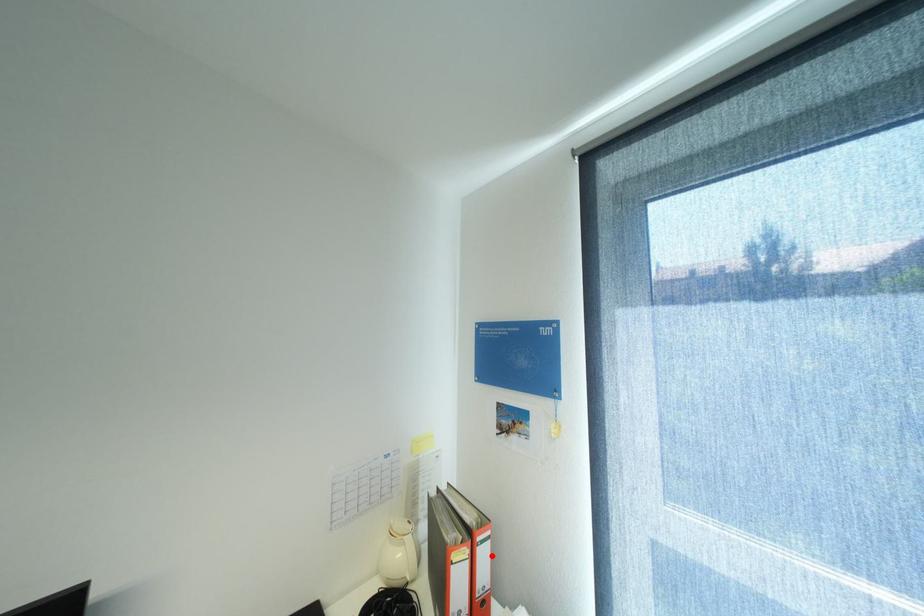
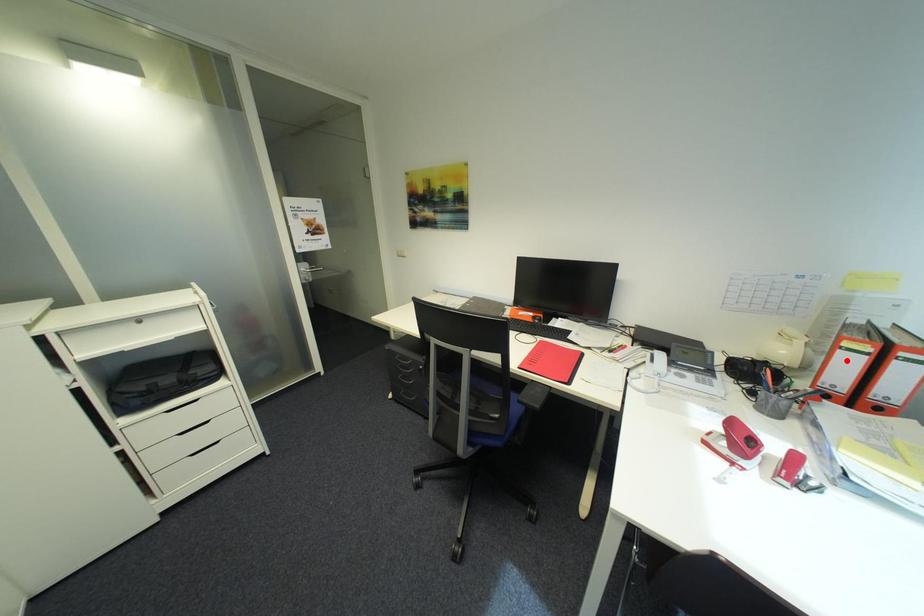
I am providing you with two images of the same scene from different viewpoints. A red point is marked on the first image and another point is marked on the second image. Are the points marked in image1 and image2 representing the same 3D position?

No